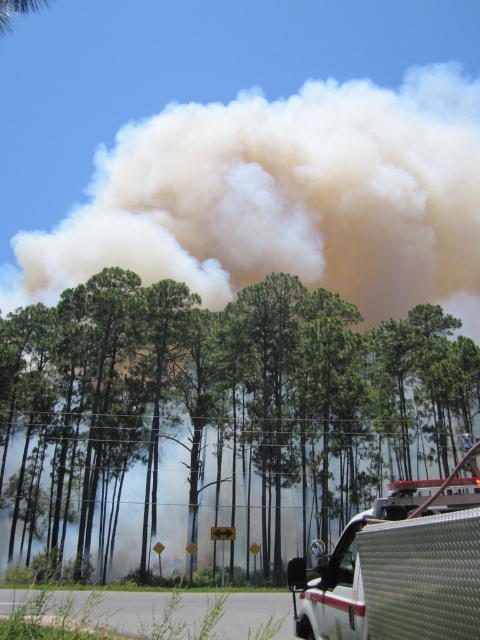
Is green leafy tree at center wider than white textured truck at lower right?

Yes, green leafy tree at center is wider than white textured truck at lower right.

Locate an element on the screen. The width and height of the screenshot is (480, 640). green leafy tree at center is located at coordinates (219, 404).

Identify the location of green leafy tree at center. This screenshot has height=640, width=480. (219, 404).